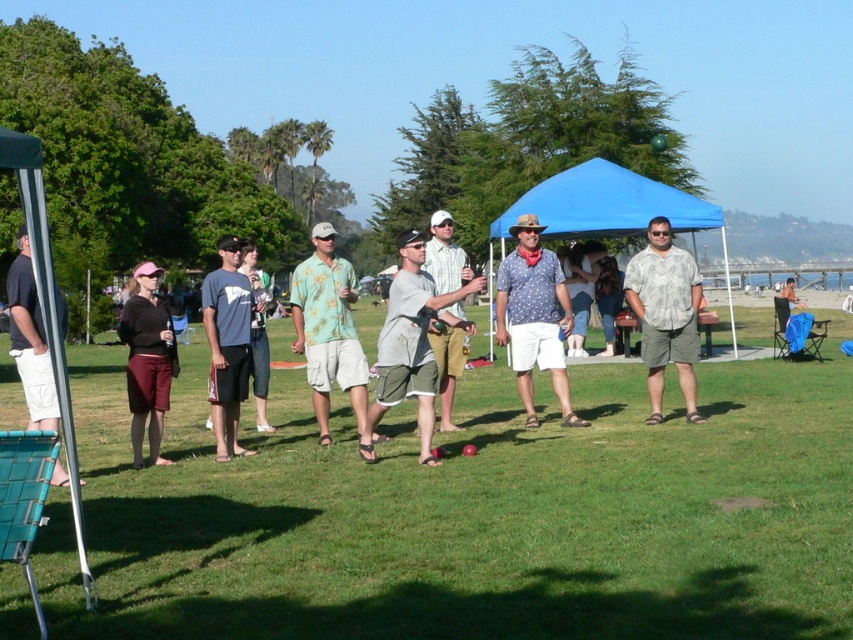
Can you confirm if floral print shirt at center is positioned to the left of matte black shirt at left?

No, floral print shirt at center is not to the left of matte black shirt at left.

Can you confirm if floral print shirt at center is positioned below matte black shirt at left?

No, floral print shirt at center is not below matte black shirt at left.

Measure the distance between point (339,291) and camera.

A distance of 10.28 meters exists between point (339,291) and camera.

Where is `floral print shirt at center`? floral print shirt at center is located at coordinates (328, 328).

Which is behind, point (264, 472) or point (497, 285)?

The point (497, 285) is more distant.

Which is in front, point (144, 604) or point (553, 257)?

Point (144, 604) is more forward.

Find the location of a particular element. green grass at center is located at coordinates [471, 513].

Who is taller, matte gray t-shirt at center or dark gray shorts at left?

Standing taller between the two is matte gray t-shirt at center.

Can you confirm if matte gray t-shirt at center is smaller than dark gray shorts at left?

No.

Where is `matte gray t-shirt at center`? The image size is (853, 640). matte gray t-shirt at center is located at coordinates (227, 346).